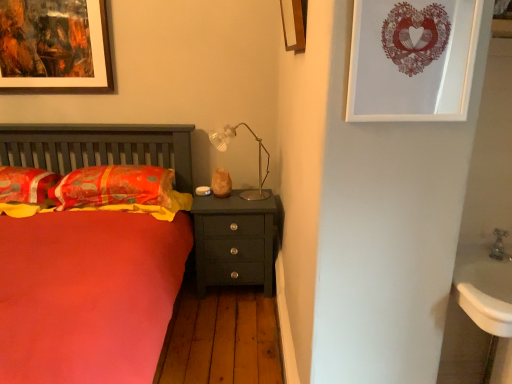
This screenshot has height=384, width=512. Identify the location of vacant space in gold metallic table lamp at center (from a real-world perspective). [233, 198].